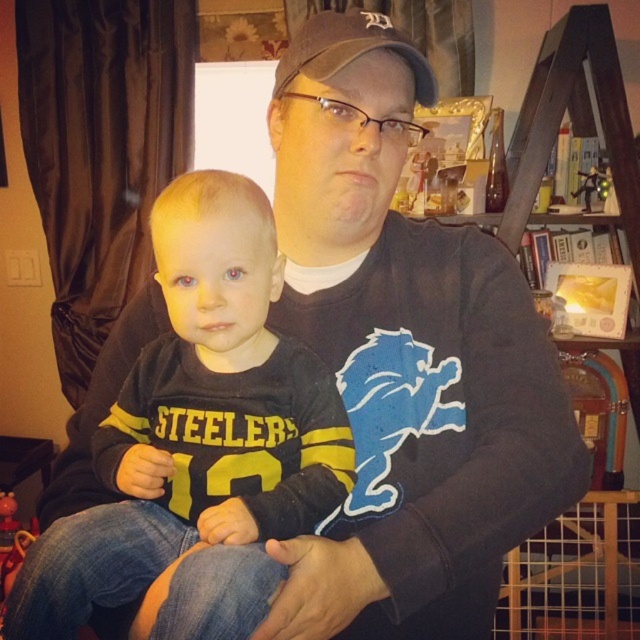
You are a photographer setting up a shot in this scene. You need to place a small prop exactly at the coordinates given for the black jersey at center. Where should you place the prop relative to the center of the image?

The prop should be placed at the coordinates 0.688 on the x axis and 0.312 on the y axis relative to the center of the image.

You are a photographer setting up for a family portrait. You notice the black jersey at center and the brown fabric baseball cap at upper center in the scene. Based on their positions, which object is positioned higher up in the image?

The black jersey at center is taller than the brown fabric baseball cap at upper center, so the black jersey at center is positioned higher up in the image.